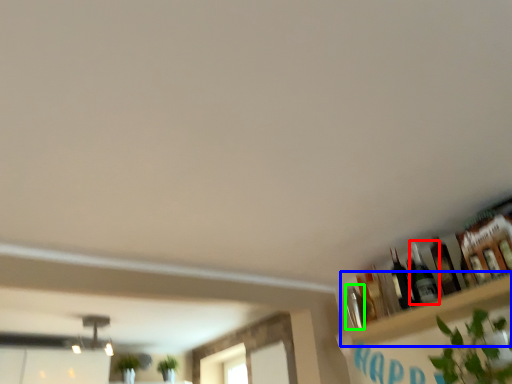
Question: Which object is the closest to the bottle (highlighted by a red box)? Choose among these: shelf (highlighted by a blue box) or bottle (highlighted by a green box).

Choices:
 (A) shelf
 (B) bottle

Answer: (A)